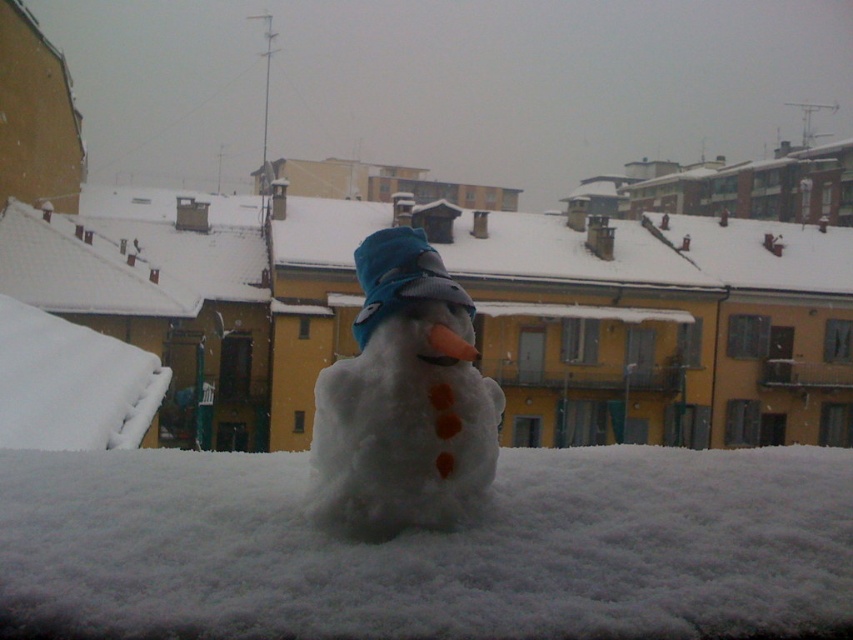
Does white fluffy snow at center come behind white fluffy snowman at center?

No, it is in front of white fluffy snowman at center.

Is white fluffy snow at center wider than white fluffy snowman at center?

Yes, white fluffy snow at center is wider than white fluffy snowman at center.

Is point (355, 596) behind point (469, 401)?

No, (355, 596) is closer to viewer.

At what (x,y) coordinates should I click in order to perform the action: click on white fluffy snow at center. Please return your answer as a coordinate pair (x, y). Image resolution: width=853 pixels, height=640 pixels. Looking at the image, I should click on (431, 548).